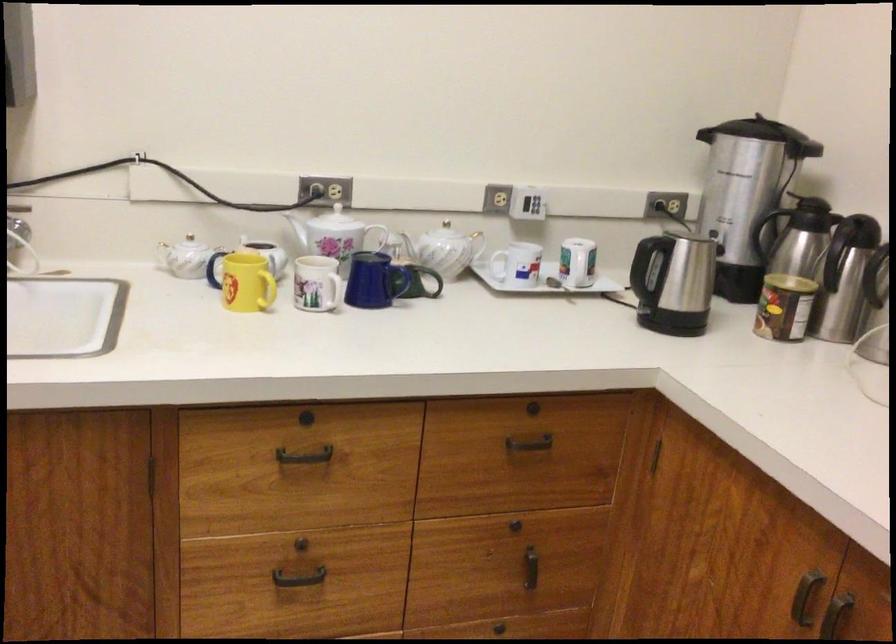
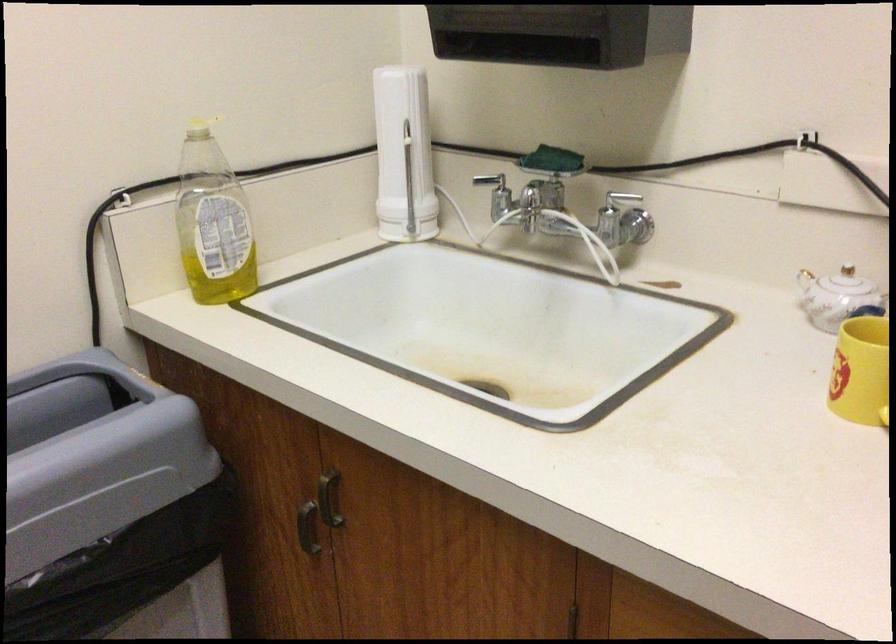
Question: I am providing you with two images of the same scene from different viewpoints. Which of the following objects are not visible in image2?

Choices:
 (A) dish soap pump
 (B) yellow mug handle
 (C) dark cabinet handle
 (D) none of these

Answer: (D)